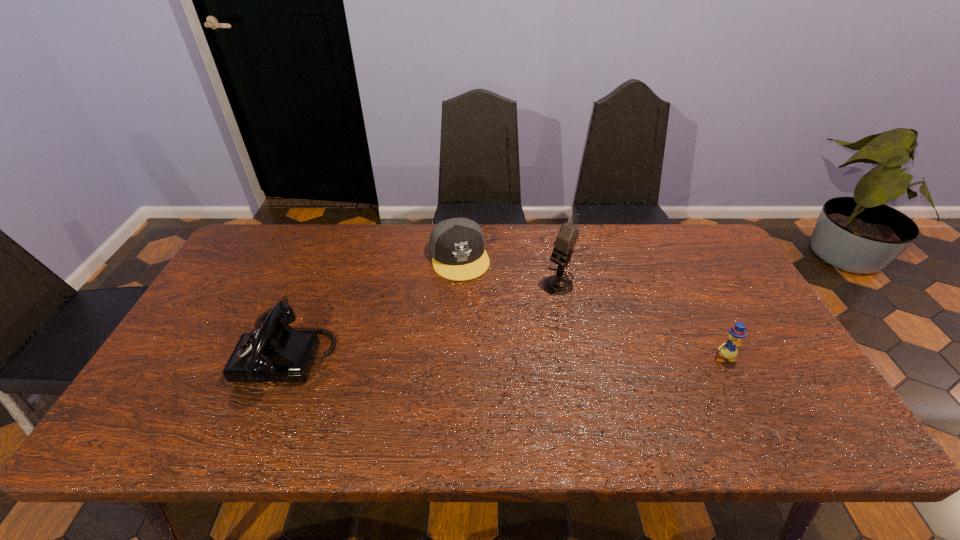
This screenshot has width=960, height=540. What are the coordinates of `telephone` in the screenshot? It's located at (275, 352).

This screenshot has width=960, height=540. Find the location of `the third shortest object`. the third shortest object is located at coordinates (275, 352).

The width and height of the screenshot is (960, 540). Identify the location of the rightmost object. (728, 350).

Find the location of a particular element. This screenshot has height=540, width=960. the third object from left to right is located at coordinates (558, 285).

Locate an element on the screen. Image resolution: width=960 pixels, height=540 pixels. the tallest object is located at coordinates click(558, 285).

This screenshot has height=540, width=960. I want to click on cap, so click(x=457, y=246).

At what (x,y) coordinates should I click in order to perform the action: click on free space located on the dial of the telephone. Please return your answer as a coordinate pair (x, y). Image resolution: width=960 pixels, height=540 pixels. Looking at the image, I should click on (220, 352).

This screenshot has height=540, width=960. Identify the location of free spot located on the dial of the telephone. (197, 352).

Locate an element on the screen. The width and height of the screenshot is (960, 540). free location located on the face of the duckling, where the monocle is placed is located at coordinates (743, 396).

Locate an element on the screen. The height and width of the screenshot is (540, 960). free space located 0.240m on the front-facing side of the second object from right to left is located at coordinates (493, 336).